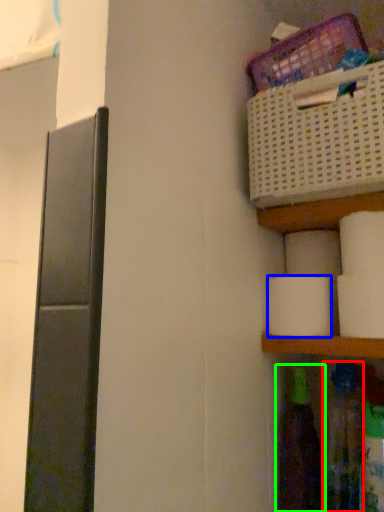
Question: Based on their relative distances, which object is farther from bottle (highlighted by a red box)? Choose from toilet paper (highlighted by a blue box) and bottle (highlighted by a green box).

Choices:
 (A) toilet paper
 (B) bottle

Answer: (A)